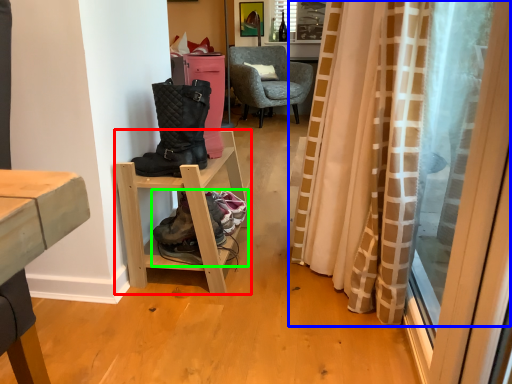
Question: Based on their relative distances, which object is farther from shelf (highlighted by a red box)? Choose from curtain (highlighted by a blue box) and footwear (highlighted by a green box).

Choices:
 (A) curtain
 (B) footwear

Answer: (A)